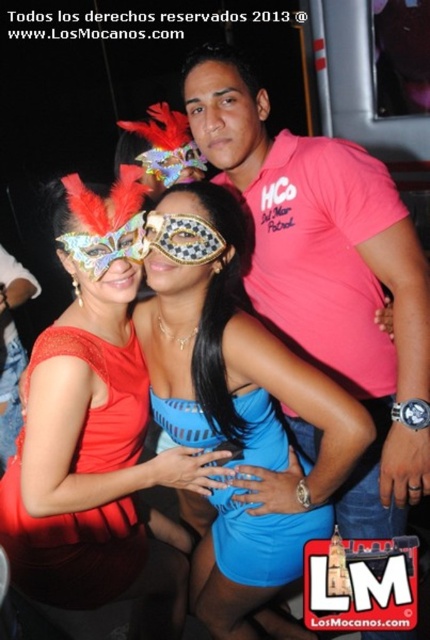
Does shiny blue dress at center appear on the right side of blue jersey at center?

In fact, shiny blue dress at center is to the left of blue jersey at center.

Describe the element at coordinates (97, 435) in the screenshot. I see `shiny blue dress at center` at that location.

Is point (88, 593) farther from camera compared to point (211, 438)?

That is True.

The height and width of the screenshot is (640, 430). In order to click on shiny blue dress at center in this screenshot , I will do `click(97, 435)`.

In the scene shown: Who is more forward, (251, 566) or (34, 561)?

Point (34, 561) is in front.

Describe the element at coordinates (239, 412) in the screenshot. I see `blue satin dress at center` at that location.

You are a GUI agent. You are given a task and a screenshot of the screen. Output one action in this format:
    pyautogui.click(x=<x>, y=<y>)
    Task: Click on the blue satin dress at center
    The width and height of the screenshot is (430, 640).
    Given the screenshot: What is the action you would take?
    pyautogui.click(x=239, y=412)

Is shiny blue dress at center closer to camera compared to blue satin dress at center?

No.

Who is more forward, (107, 513) or (217, 604)?

Positioned in front is point (107, 513).

Where is `shiny blue dress at center`? shiny blue dress at center is located at coordinates (97, 435).